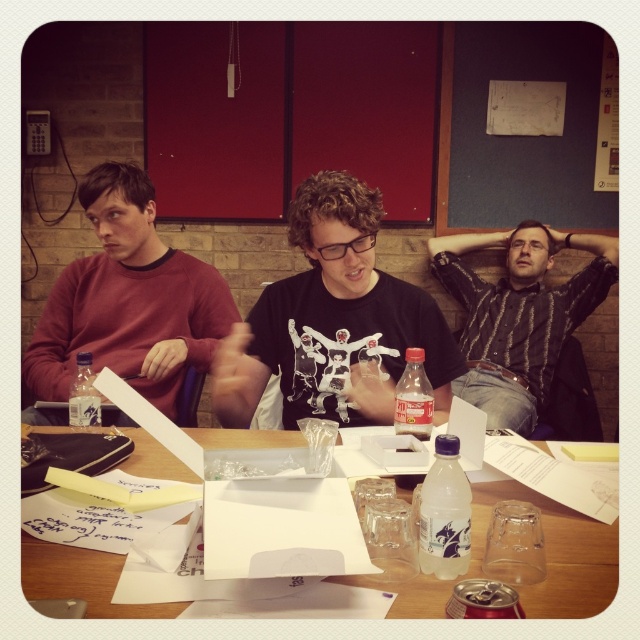
Question: Can you confirm if wooden table at center is smaller than clear plastic bottle at table center?

Choices:
 (A) no
 (B) yes

Answer: (B)

Question: Which point appears farthest from the camera in this image?

Choices:
 (A) (106, 614)
 (B) (364, 385)
 (C) (192, 310)
 (D) (90, 422)

Answer: (C)

Question: Which object appears farthest from the camera in this image?

Choices:
 (A) clear plastic bottle at center
 (B) clear plastic bottle at table center
 (C) black matte t-shirt at center

Answer: (B)

Question: Does wooden table at center lie behind clear plastic bottle at table center?

Choices:
 (A) yes
 (B) no

Answer: (B)

Question: Does wooden table at center appear on the right side of striped shirt at upper right?

Choices:
 (A) no
 (B) yes

Answer: (A)

Question: Which object is farther from the camera taking this photo?

Choices:
 (A) striped shirt at upper right
 (B) clear plastic bottle at table center

Answer: (A)